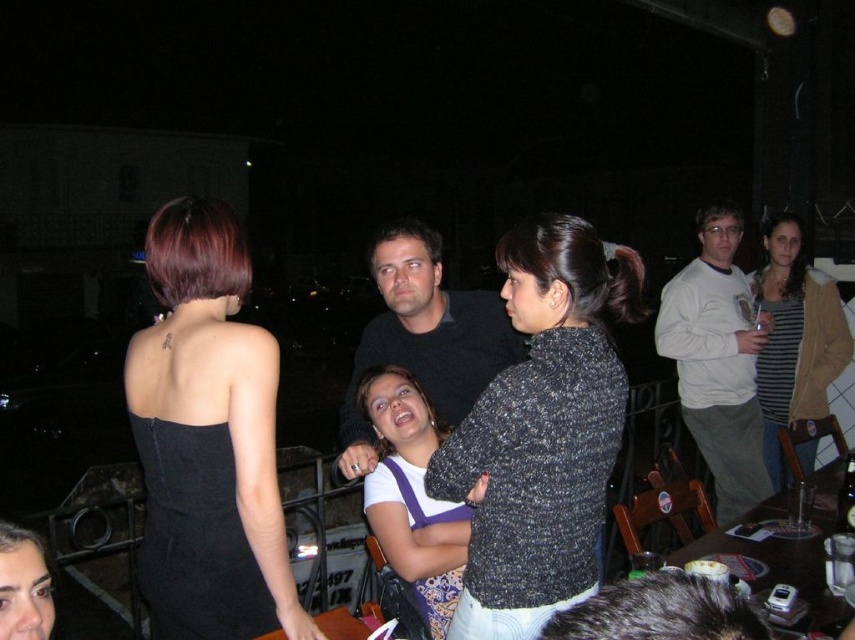
Does black matte shirt at center appear under striped knit sweater at upper right?

Incorrect, black matte shirt at center is not positioned below striped knit sweater at upper right.

Is black matte shirt at center shorter than striped knit sweater at upper right?

Yes, black matte shirt at center is shorter than striped knit sweater at upper right.

Is point (348, 451) less distant than point (805, 321)?

Yes, it is in front of point (805, 321).

Image resolution: width=855 pixels, height=640 pixels. In order to click on black matte shirt at center in this screenshot , I will do [423, 337].

Does black matte dress at upper left have a lesser width compared to striped knit sweater at upper right?

Incorrect, black matte dress at upper left's width is not less than striped knit sweater at upper right's.

This screenshot has height=640, width=855. Find the location of `black matte dress at upper left`. black matte dress at upper left is located at coordinates pos(208,440).

Which of these two, speckled sweater at center or white jersey at center, stands shorter?

Standing shorter between the two is white jersey at center.

At what (x,y) coordinates should I click in order to perform the action: click on speckled sweater at center. Please return your answer as a coordinate pair (x, y). Image resolution: width=855 pixels, height=640 pixels. Looking at the image, I should click on (541, 432).

Is point (597, 381) in front of point (434, 636)?

Yes, point (597, 381) is in front of point (434, 636).

The image size is (855, 640). Identify the location of speckled sweater at center. (541, 432).